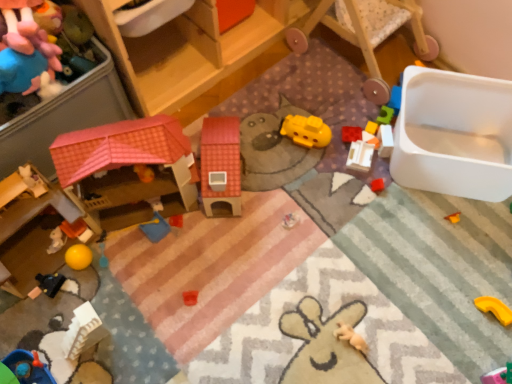
Identify the location of vacant space to the right of blue fabric toy at center, arranged as the third toy when viewed from the left. coord(208,236).